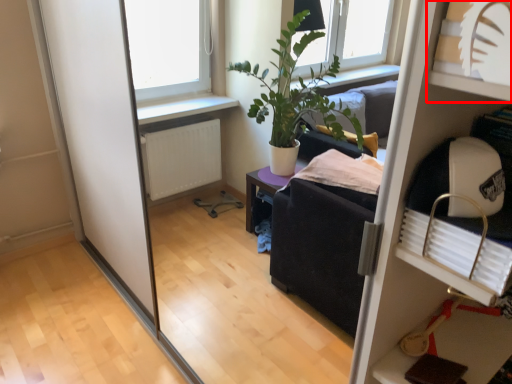
Question: In this image, where is shelf (annotated by the red box) located relative to shelf?

Choices:
 (A) left
 (B) right

Answer: (A)